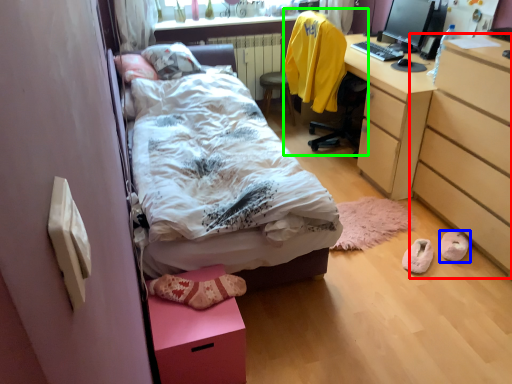
Question: Considering the real-world distances, which object is farthest from chest of drawers (highlighted by a red box)? footwear (highlighted by a blue box) or chair (highlighted by a green box)?

Choices:
 (A) footwear
 (B) chair

Answer: (B)